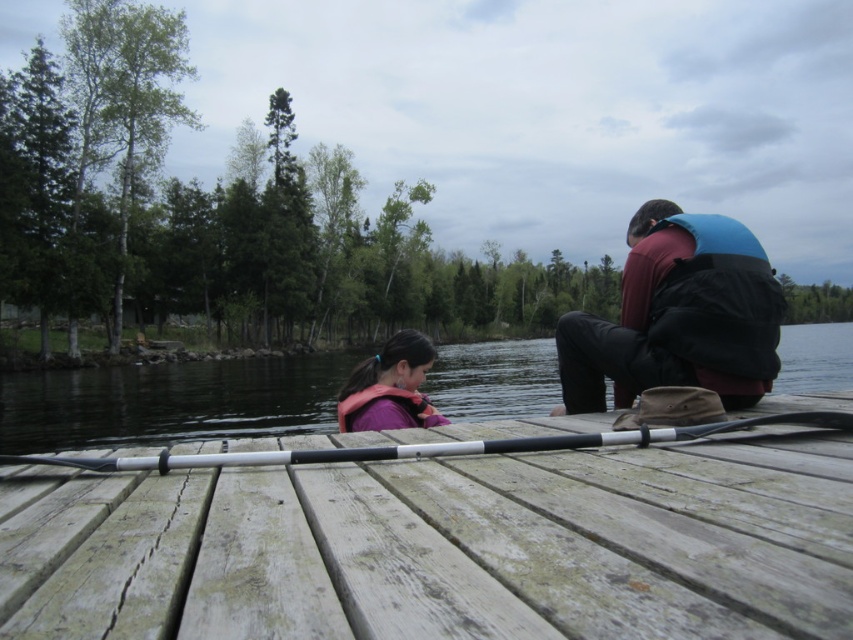
You are planning to place a small potted plant on the weathered wood dock at center and the black rubber paddle at center. Which surface can accommodate the pot more easily?

The black rubber paddle at center is wider than the weathered wood dock at center, so it can accommodate the pot more easily.

In the scene shown: You are planning to place a small picnic basket on the weathered wood dock at center. Considering the size of the blue matte life vest at right, will there be enough space to place the basket without it overlapping with the life vest?

The weathered wood dock at center is wider than the blue matte life vest at right, so there should be enough space to place the picnic basket without overlapping.

You are standing on the dock and want to move to the point marked by coordinates point (x=439, y=540). Is the weathered wood dock at center the correct location to go to?

Yes, the weathered wood dock at center is represented by point (x=439, y=540), so moving to that point will take you to the correct location.